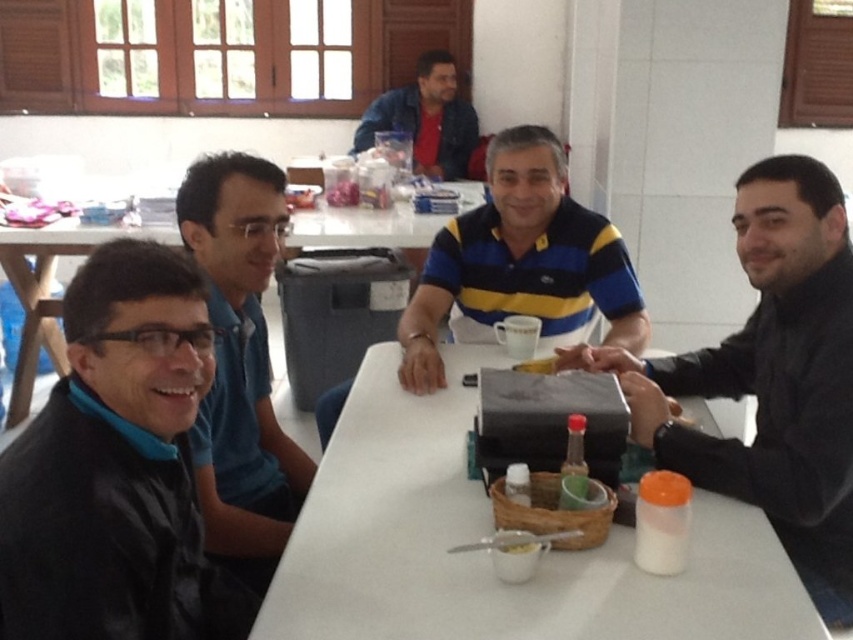
You are sitting at the denim jacket at upper center. Looking towards the white matte table at center, which direction should you turn to face it?

Since the white matte table at center is to the right of the denim jacket at upper center, you should turn to your right to face it.

What are the coordinates of the yellow striped polo shirt at center?

The coordinates of the yellow striped polo shirt at center are at point (521, 260).